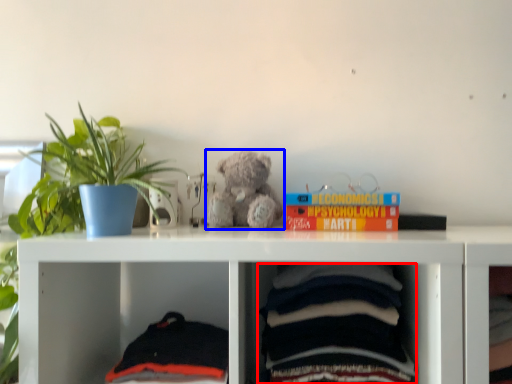
Question: Among these objects, which one is farthest to the camera, baby clothe (highlighted by a red box) or teddy bear (highlighted by a blue box)?

Choices:
 (A) baby clothe
 (B) teddy bear

Answer: (B)